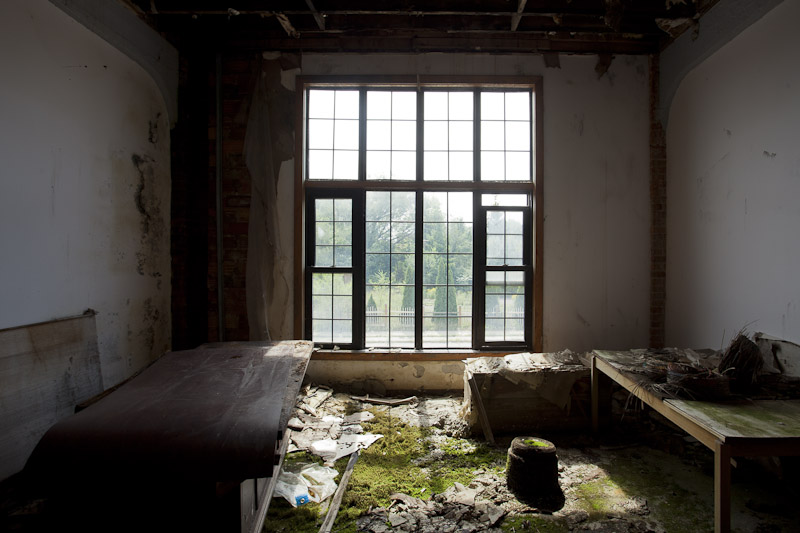
Identify the location of window. This screenshot has height=533, width=800. (410, 287).